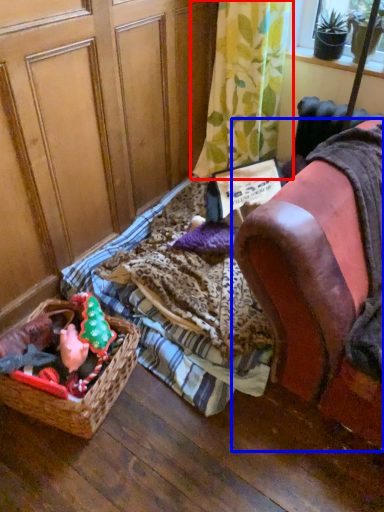
Question: Which of the following is the closest to the observer, curtain (highlighted by a red box) or furniture (highlighted by a blue box)?

Choices:
 (A) curtain
 (B) furniture

Answer: (B)